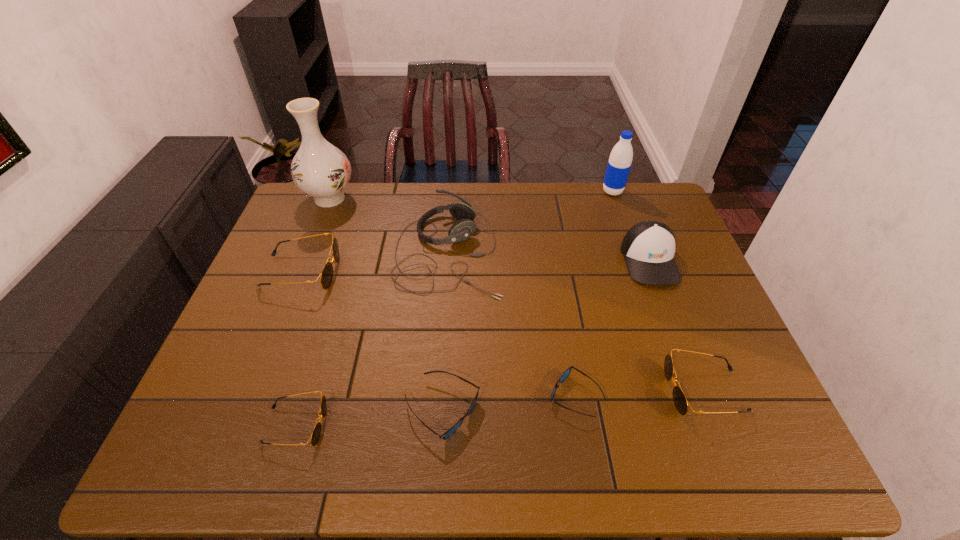
Where is `free space located 0.190m on the front-facing side of the rightmost black sunglasses`? This screenshot has height=540, width=960. free space located 0.190m on the front-facing side of the rightmost black sunglasses is located at coordinates (585, 390).

At what (x,y) coordinates should I click in order to perform the action: click on vacant space located on the front-facing side of the rightmost black sunglasses. Please return your answer as a coordinate pair (x, y). This screenshot has width=960, height=540. Looking at the image, I should click on (503, 390).

Where is `vacant position located at the front of the bigger blue sunglasses showing the lenses`? vacant position located at the front of the bigger blue sunglasses showing the lenses is located at coordinates 628,410.

The image size is (960, 540). I want to click on free region located on the front-facing side of the smallest black sunglasses, so click(352, 425).

Where is `blank space located 0.270m at the front of the shortest object showing the lenses`? The image size is (960, 540). blank space located 0.270m at the front of the shortest object showing the lenses is located at coordinates (429, 396).

You are a GUI agent. You are given a task and a screenshot of the screen. Output one action in this format:
    pyautogui.click(x=<x>, y=<y>)
    Task: Click on the vacant region located 0.230m at the front of the shortest object showing the lenses
    
    Given the screenshot: What is the action you would take?
    pyautogui.click(x=446, y=396)

This screenshot has width=960, height=540. In order to click on vacant space located 0.300m at the front of the shortest object showing the lenses in this screenshot , I will do `click(417, 396)`.

At what (x,y) coordinates should I click in order to perform the action: click on vase that is at the far edge. Please return your answer as a coordinate pair (x, y). Looking at the image, I should click on (321, 170).

This screenshot has width=960, height=540. Find the location of `water bottle positioned at the far edge`. water bottle positioned at the far edge is located at coordinates (620, 160).

Locate an element on the screen. This screenshot has width=960, height=540. headset positioned at the far edge is located at coordinates (462, 230).